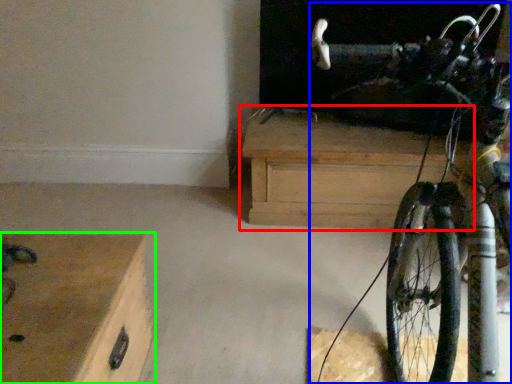
Question: Which object is positioned farthest from chest of drawers (highlighted by a red box)? Select from bicycle (highlighted by a blue box) and chest of drawers (highlighted by a green box).

Choices:
 (A) bicycle
 (B) chest of drawers

Answer: (B)